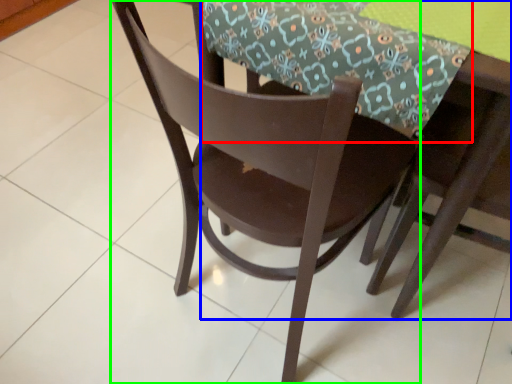
Question: Considering the real-world distances, which object is farthest from tablecloth (highlighted by a red box)? round table (highlighted by a blue box) or chair (highlighted by a green box)?

Choices:
 (A) round table
 (B) chair

Answer: (B)